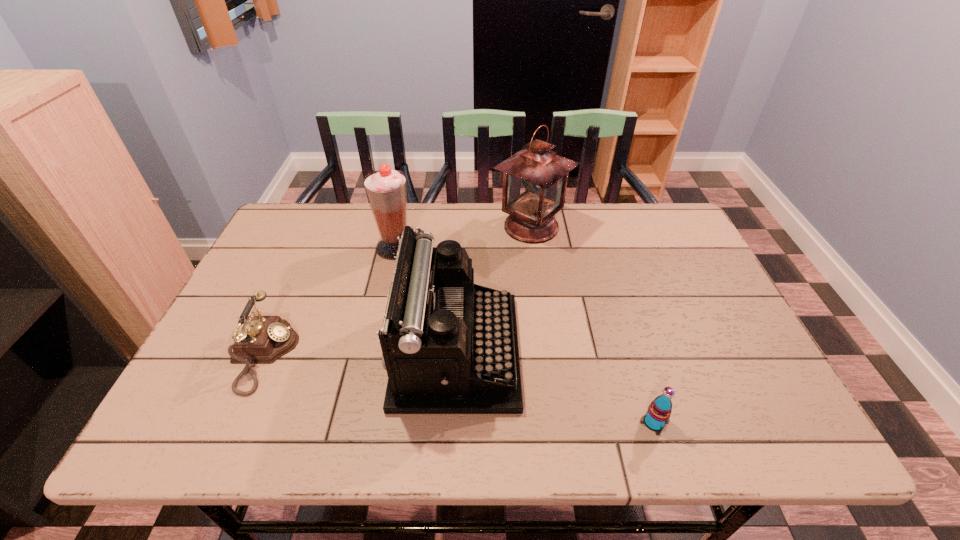
You are a GUI agent. You are given a task and a screenshot of the screen. Output one action in this format:
    pyautogui.click(x=<x>, y=<y>)
    Task: Click on the oil lamp
    The width and height of the screenshot is (960, 540).
    Given the screenshot: What is the action you would take?
    pyautogui.click(x=535, y=178)

At what (x,y) coordinates should I click in order to perform the action: click on smoothie. Please return your answer as a coordinate pair (x, y). The height and width of the screenshot is (540, 960). Looking at the image, I should click on (386, 189).

Identify the location of typewriter. The height and width of the screenshot is (540, 960). (449, 346).

You are a GUI agent. You are given a task and a screenshot of the screen. Output one action in this format:
    pyautogui.click(x=<x>, y=<y>)
    Task: Click on the telephone
    
    Given the screenshot: What is the action you would take?
    pyautogui.click(x=263, y=339)

This screenshot has height=540, width=960. In order to click on the rightmost object in this screenshot , I will do coord(659,411).

Where is `free region located on the left of the oil lamp`? free region located on the left of the oil lamp is located at coordinates (440, 227).

Image resolution: width=960 pixels, height=540 pixels. Find the location of `vacant point located on the back of the smoothie`. vacant point located on the back of the smoothie is located at coordinates (403, 213).

Identify the location of vacant space situated on the typing side of the typewriter. (685, 351).

You are a GUI agent. You are given a task and a screenshot of the screen. Output one action in this format:
    pyautogui.click(x=<x>, y=<y>)
    Task: Click on the blank area located on the dial of the telephone
    This screenshot has width=960, height=540.
    Given the screenshot: What is the action you would take?
    pyautogui.click(x=424, y=355)

Find the location of `free space located on the back of the soda`. free space located on the back of the soda is located at coordinates tap(636, 366).